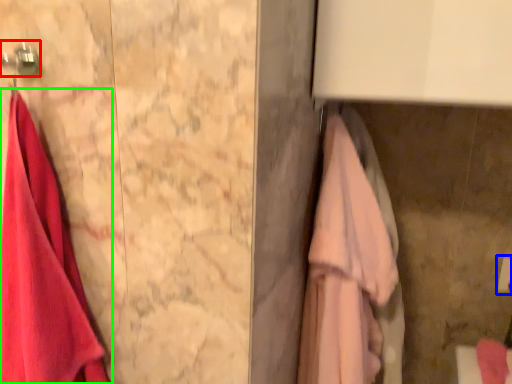
Question: Estimate the real-world distances between objects in this image. Which object is farther from hanger (highlighted by a red box), towel bar (highlighted by a blue box) or towel (highlighted by a green box)?

Choices:
 (A) towel bar
 (B) towel

Answer: (A)